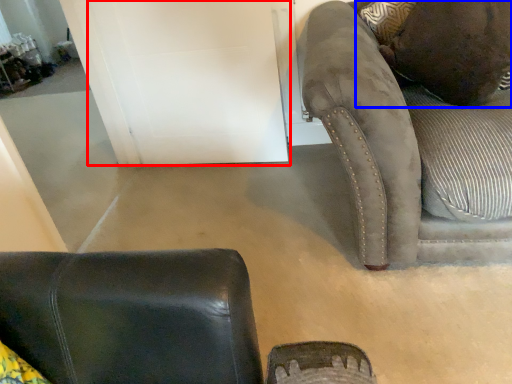
Question: Which point is closer to the camera, door (highlighted by a red box) or pillow (highlighted by a blue box)?

Choices:
 (A) door
 (B) pillow

Answer: (B)